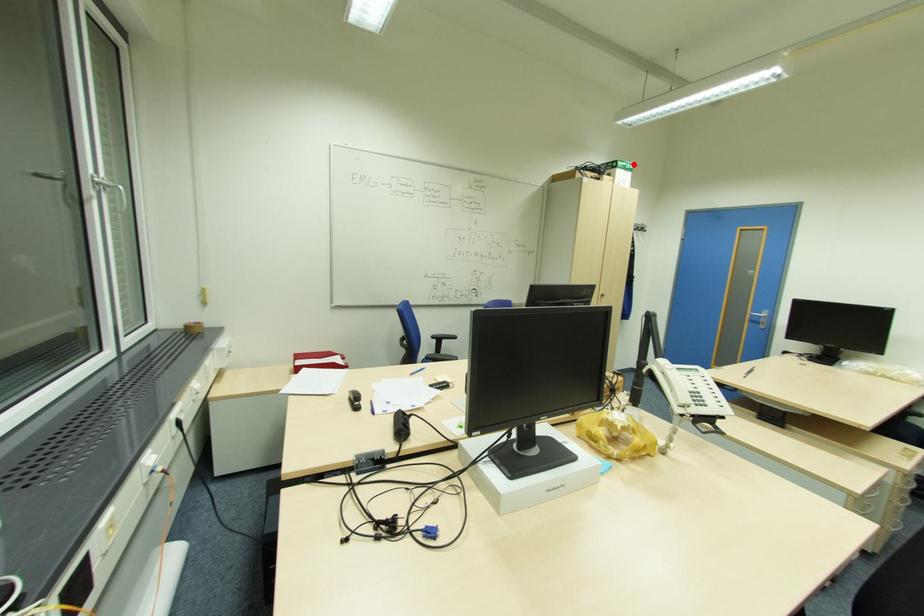
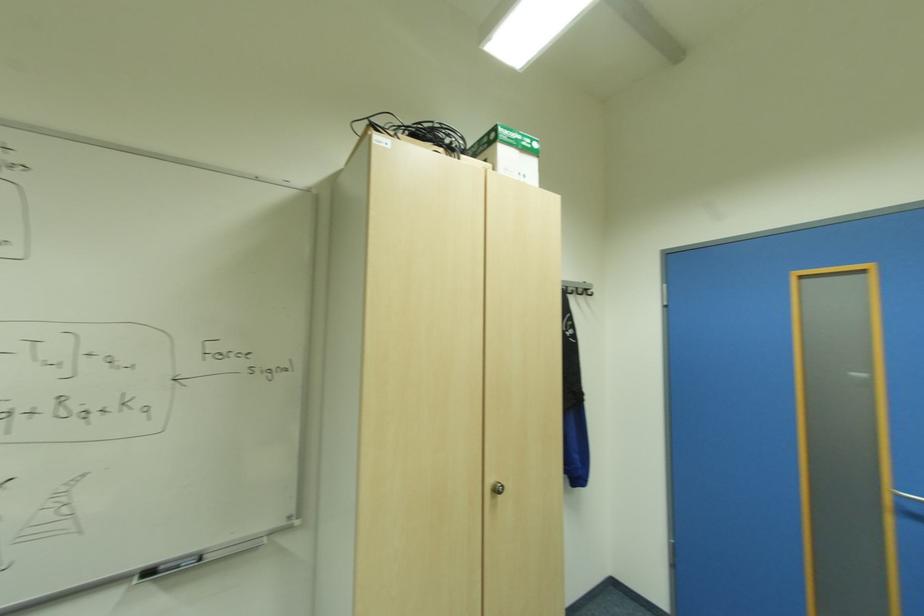
In the second image, find the point that corresponds to the highlighted location in the first image.

(533, 140)